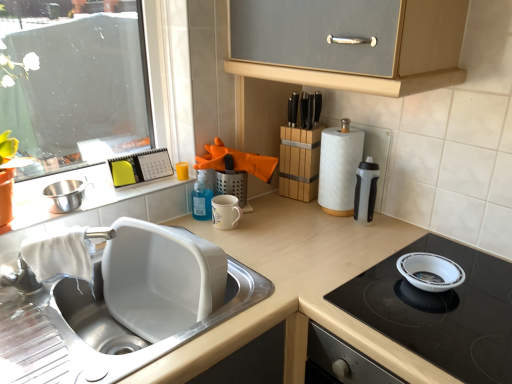
Where is `free spot to the right of white textured paper towel at right`? Image resolution: width=512 pixels, height=384 pixels. free spot to the right of white textured paper towel at right is located at coordinates (388, 230).